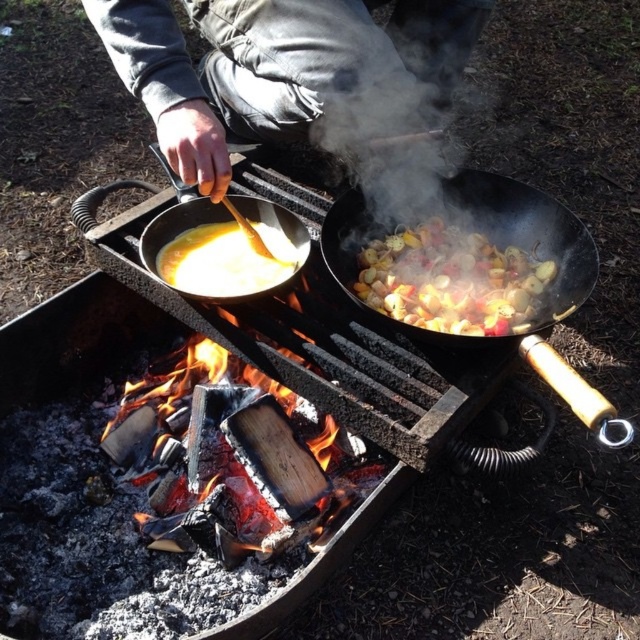
Who is lower down, black matte wok at center or matte black wok at center?

black matte wok at center is lower down.

Can you confirm if black matte wok at center is thinner than matte black wok at center?

No.

Where is `black matte wok at center`? This screenshot has width=640, height=640. black matte wok at center is located at coordinates (532, 234).

Does point (458, 272) come in front of point (204, 292)?

No.

Who is more distant from viewer, (458, 230) or (296, 262)?

Point (458, 230)

Image resolution: width=640 pixels, height=640 pixels. I want to click on shiny metallic vegetables at center, so click(x=451, y=280).

Is point (189, 273) closer to camera compared to point (262, 292)?

No, (189, 273) is behind (262, 292).

Between point (240, 291) and point (198, 221), which one is positioned in front?

Point (240, 291) is more forward.

Is point (225, 280) in front of point (298, 248)?

Yes, point (225, 280) is in front of point (298, 248).

Find the location of `yellow creamy soup at center`. yellow creamy soup at center is located at coordinates click(225, 260).